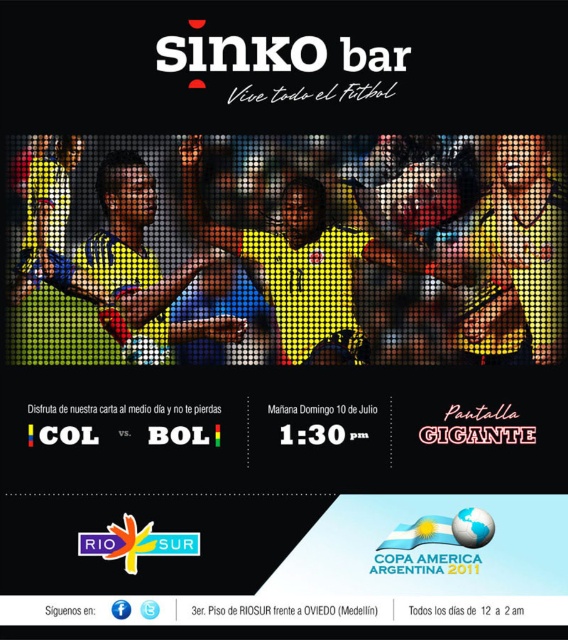
You are designing a promotional poster for a sports bar event. The poster has a central pixelated image of soccer players celebrating in yellow jerseys. You need to place a small logo exactly at the point with coordinates point (99, 275). Based on the information provided, where will this logo be placed on the poster?

The point (99, 275) is on the yellow jersey at center, so placing the logo at this coordinate will position it on the central yellow jersey in the soccer players celebrating image.

You are standing in front of the promotional poster for Sinko Bar. You see two points marked on the poster. The first point is at position point [358,337] and the second point is at point [198,614]. Which point is closer to you?

Point [198,614] is closer to you because it is in front of point [358,337].